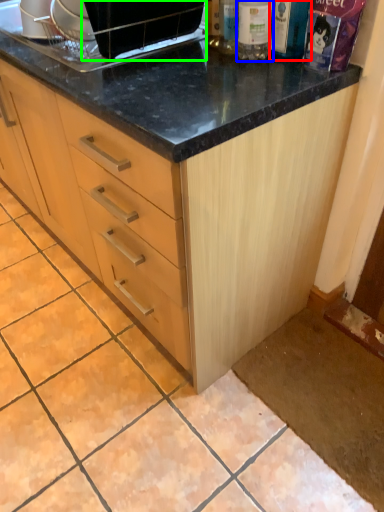
Question: Based on their relative distances, which object is farther from bottle (highlighted by a red box)? Choose from bottle (highlighted by a blue box) and appliance (highlighted by a green box).

Choices:
 (A) bottle
 (B) appliance

Answer: (B)